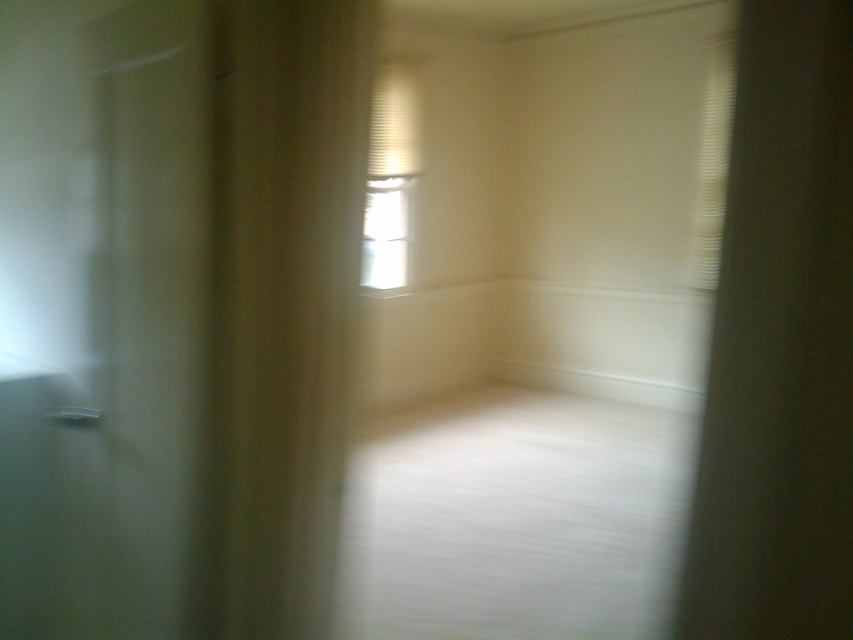
You are standing in the room and want to let more natural light in. Which object should you adjust to achieve this? The beige fabric curtain at left or the transparent glass window at center?

The beige fabric curtain at left is located below transparent glass window at center. To let more natural light in, you should adjust the transparent glass window at center since it is the window allowing light in, while the curtain is below it and may not directly affect the light entering through the window.

You are standing in the room and want to open the window to let in more light. Which object, the beige fabric curtain at left or the transparent glass window at center, do you need to move first to access the window?

You need to move the beige fabric curtain at left first because it is closer to the viewer and obstructing access to the transparent glass window at center.

From the picture: You are a delivery person trying to place a large package in this room. The package requires 12 feet of space between it and any windows to avoid blocking light. Can you safely place the package between the beige fabric curtain at left and the transparent glass window at center?

The beige fabric curtain at left is 10.96 feet from the transparent glass window at center. Since the required space is 12 feet, the distance is insufficient. Therefore, placing the package between them would not meet the requirement.